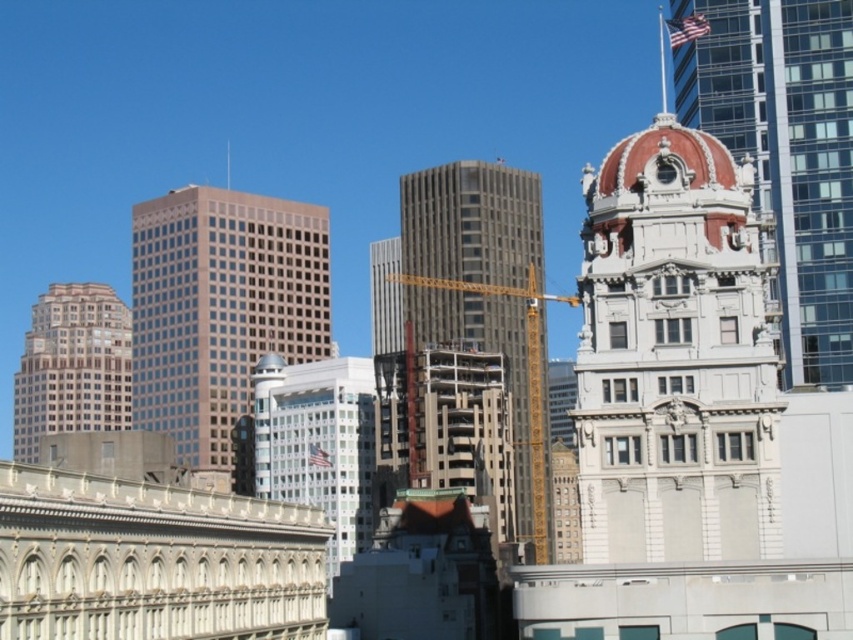
Looking at this image, can you confirm if matte glass skyscraper at center is positioned to the left of white stone building at center?

Yes, matte glass skyscraper at center is to the left of white stone building at center.

Does matte glass skyscraper at center lie in front of white stone building at center?

No.

Between point (155, 380) and point (746, 45), which one is positioned behind?

The point (155, 380) is behind.

Locate an element on the screen. matte glass skyscraper at center is located at coordinates (219, 310).

Can you confirm if white stone building at center is shorter than beige glass skyscraper at left?

No, white stone building at center is not shorter than beige glass skyscraper at left.

What do you see at coordinates (786, 152) in the screenshot? I see `white stone building at center` at bounding box center [786, 152].

Who is more distant from viewer, (839,24) or (109,412)?

The point (109,412) is more distant.

Identify the location of white stone building at center. The height and width of the screenshot is (640, 853). (786, 152).

Between point (850, 205) and point (498, 179), which one is positioned behind?

The point (498, 179) is behind.

Between white stone building at center and gray concrete building at center, which one is positioned lower?

gray concrete building at center is lower down.

Who is more distant from viewer, [842,180] or [447,308]?

Positioned behind is point [447,308].

The height and width of the screenshot is (640, 853). What are the coordinates of `white stone building at center` in the screenshot? It's located at (786, 152).